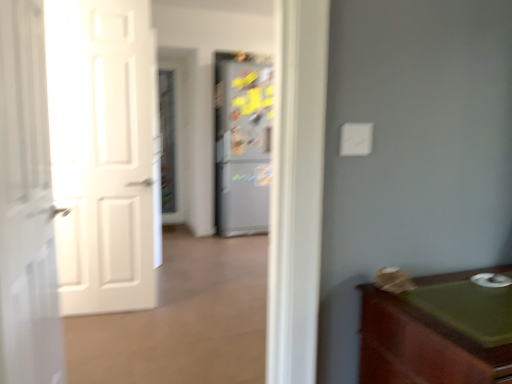
Question: Is white glossy door at left, the 1th door viewed from the front, bigger than clear glass screen door at center?

Choices:
 (A) yes
 (B) no

Answer: (A)

Question: From a real-world perspective, does white glossy door at left, positioned as the second door in back-to-front order, sit lower than clear glass screen door at center?

Choices:
 (A) no
 (B) yes

Answer: (B)

Question: Is the surface of white glossy door at left, positioned as the second door in back-to-front order, in direct contact with clear glass screen door at center?

Choices:
 (A) no
 (B) yes

Answer: (A)

Question: Is white glossy door at left, the 1th door viewed from the front, aimed at clear glass screen door at center?

Choices:
 (A) no
 (B) yes

Answer: (A)

Question: Can you confirm if white glossy door at left, positioned as the second door in back-to-front order, is shorter than clear glass screen door at center?

Choices:
 (A) no
 (B) yes

Answer: (B)

Question: Is the position of white glossy door at left, positioned as the second door in back-to-front order, less distant than that of clear glass screen door at center?

Choices:
 (A) yes
 (B) no

Answer: (A)

Question: Could you tell me if green wood cabinet at lower right is turned towards clear glass screen door at center?

Choices:
 (A) yes
 (B) no

Answer: (B)

Question: Is green wood cabinet at lower right thinner than clear glass screen door at center?

Choices:
 (A) no
 (B) yes

Answer: (A)

Question: From a real-world perspective, is green wood cabinet at lower right physically above clear glass screen door at center?

Choices:
 (A) yes
 (B) no

Answer: (B)

Question: From a real-world perspective, is green wood cabinet at lower right physically below clear glass screen door at center?

Choices:
 (A) no
 (B) yes

Answer: (B)

Question: Considering the relative sizes of green wood cabinet at lower right and clear glass screen door at center in the image provided, is green wood cabinet at lower right shorter than clear glass screen door at center?

Choices:
 (A) yes
 (B) no

Answer: (A)

Question: Is there a large distance between green wood cabinet at lower right and clear glass screen door at center?

Choices:
 (A) yes
 (B) no

Answer: (A)

Question: Considering the relative sizes of green wood cabinet at lower right and metallic gray refrigerator at center in the image provided, is green wood cabinet at lower right wider than metallic gray refrigerator at center?

Choices:
 (A) yes
 (B) no

Answer: (B)